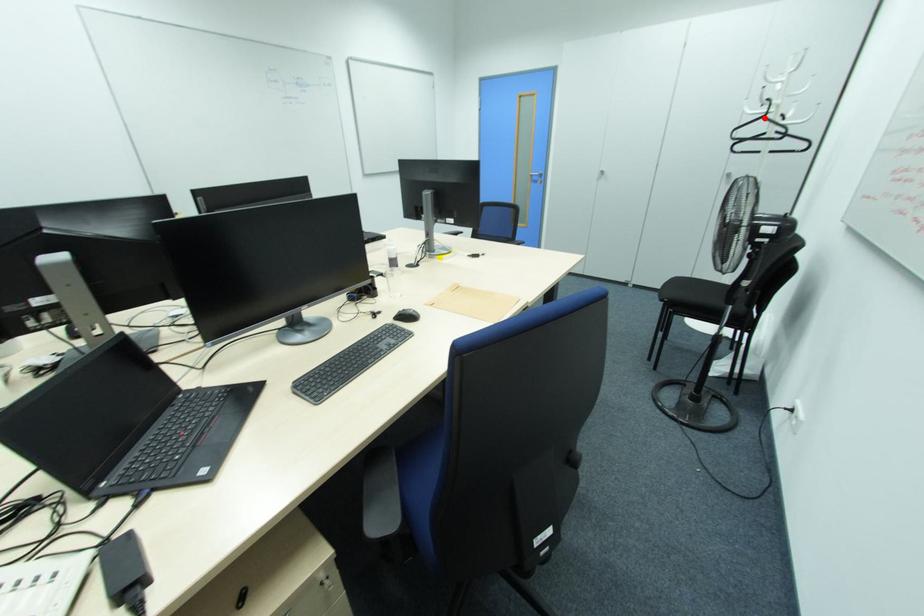
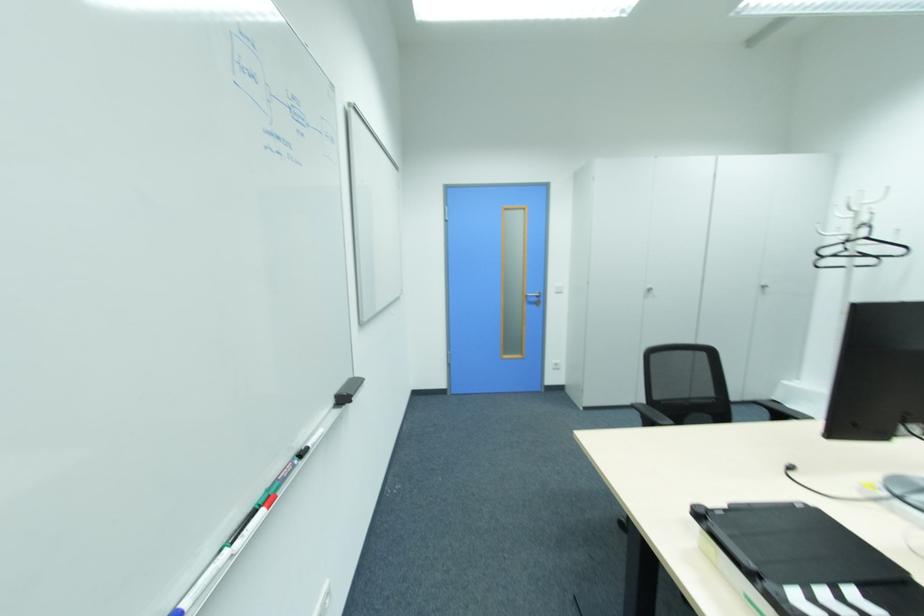
The point at the highlighted location is marked in the first image. Where is the corresponding point in the second image?

(865, 238)